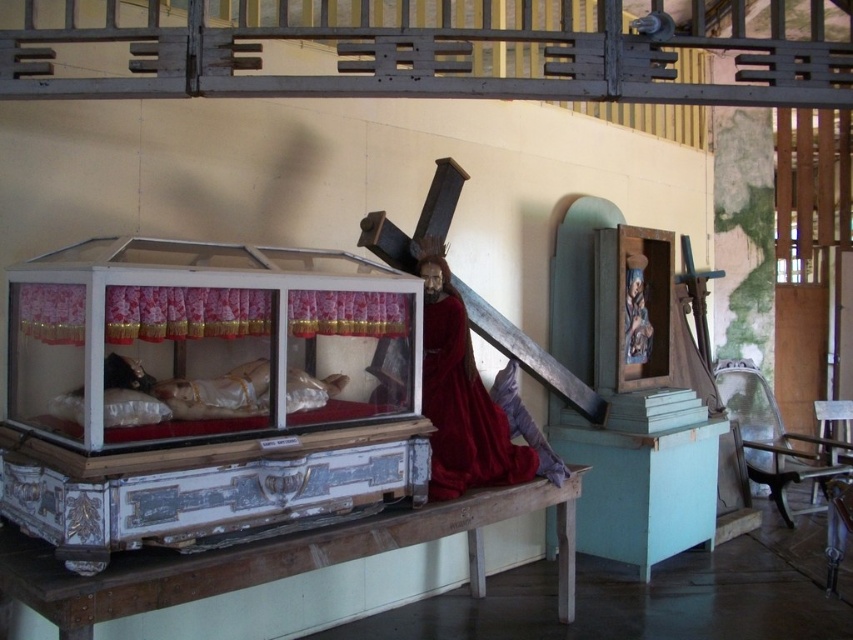
You are an interior designer tasked with arranging furniture in this room. You need to place a large rectangular table that must be positioned closer to the white painted wood altar at lower center than to the red velvet robe at center. Given the spatial relationship between these two objects, where should you place the table?

The white painted wood altar at lower center is larger in size than the red velvet robe at center. To position the table closer to the altar, place it near the altar, ensuring it is nearer to the altar than the robe.

You are standing in the room and want to take a photo of the point at coordinates point (x=294, y=268). If your camera has a focal length of 50mm and you are 10.50 feet away from the point, what is the approximate angle of view needed to capture the entire point in your photo?

The point at coordinates point (x=294, y=268) is 10.50 feet away from the camera. To calculate the angle of view needed, use the formula angle of view in degrees equals arctangent of object distance divided by focal length. However, since the object is a point, it has no dimensions, so the angle of view required would be effectively zero degrees. Therefore, any standard camera setting would easily capture the point as it has no size to frame.